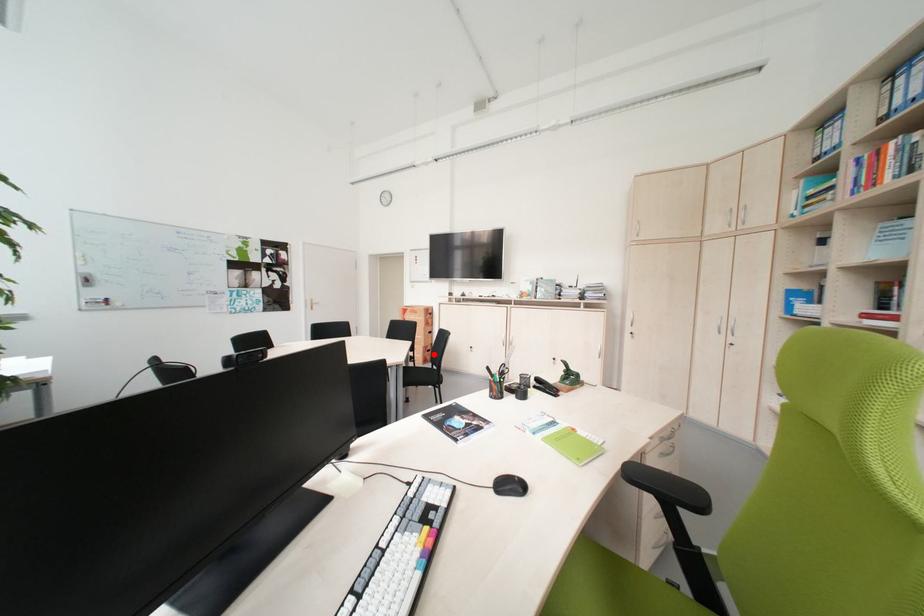
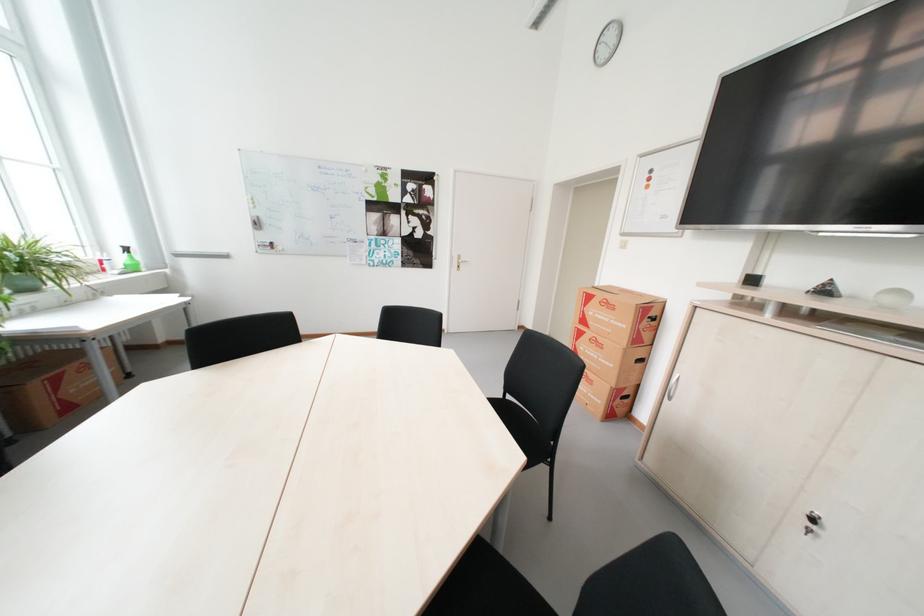
Question: I am providing you with two images of the same scene from different viewpoints. Given a red point in image1, look at the same physical point in image2. Is it:

Choices:
 (A) Closer to the viewpoint
 (B) Farther from the viewpoint

Answer: (A)